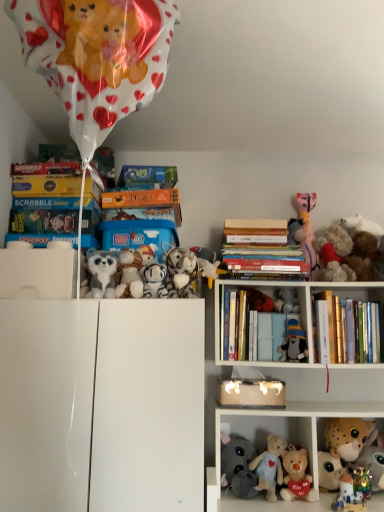
Question: In which direction should I rotate to look at hardcover books at center, which is counted as the third book, starting from the top?

Choices:
 (A) right
 (B) left

Answer: (A)

Question: Is white glossy cabinet at center, placed as the 1th shelf when sorted from left to right, positioned behind fluffy plush toys at right, arranged as the tenth toy when viewed from the left?

Choices:
 (A) no
 (B) yes

Answer: (A)

Question: Considering the relative positions of white glossy cabinet at center, the 2th shelf viewed from the right, and fluffy plush toys at right, the 3th toy positioned from the right, in the image provided, is white glossy cabinet at center, the 2th shelf viewed from the right, to the right of fluffy plush toys at right, the 3th toy positioned from the right, from the viewer's perspective?

Choices:
 (A) yes
 (B) no

Answer: (B)

Question: Are white glossy cabinet at center, the 2th shelf viewed from the right, and fluffy plush toys at right, the 3th toy positioned from the right, beside each other?

Choices:
 (A) yes
 (B) no

Answer: (B)

Question: From the image's perspective, is white glossy cabinet at center, placed as the 1th shelf when sorted from left to right, over fluffy plush toys at right, the 3th toy positioned from the right?

Choices:
 (A) no
 (B) yes

Answer: (A)

Question: Are white glossy cabinet at center, the 2th shelf viewed from the right, and fluffy plush toys at right, arranged as the tenth toy when viewed from the left, far apart?

Choices:
 (A) no
 (B) yes

Answer: (A)

Question: Would you say white glossy cabinet at center, placed as the 1th shelf when sorted from left to right, is outside fluffy plush toys at right, the 3th toy positioned from the right?

Choices:
 (A) yes
 (B) no

Answer: (A)

Question: Is the depth of green cardboard book at upper center, the first book in the top-to-bottom sequence, greater than that of soft plush bear at center, which is the 5th toy in left-to-right order?

Choices:
 (A) yes
 (B) no

Answer: (A)

Question: From the image's perspective, is green cardboard book at upper center, the 2th book viewed from the left, under soft plush bear at center, which is the 5th toy in left-to-right order?

Choices:
 (A) no
 (B) yes

Answer: (A)

Question: From a real-world perspective, is green cardboard book at upper center, the first book in the top-to-bottom sequence, on top of soft plush bear at center, which is the 5th toy in left-to-right order?

Choices:
 (A) yes
 (B) no

Answer: (A)

Question: Would you say green cardboard book at upper center, the 2th book viewed from the left, is outside soft plush bear at center, which is the 8th toy from right to left?

Choices:
 (A) yes
 (B) no

Answer: (A)

Question: Does green cardboard book at upper center, which ranks as the 4th book in bottom-to-top order, turn towards soft plush bear at center, which is the 8th toy from right to left?

Choices:
 (A) yes
 (B) no

Answer: (B)

Question: Can you confirm if green cardboard book at upper center, the third book in the right-to-left sequence, is smaller than soft plush bear at center, which is the 5th toy in left-to-right order?

Choices:
 (A) yes
 (B) no

Answer: (B)

Question: Is white plush toy at upper center, the tenth toy from the right, positioned far away from white plush toys at lower center?

Choices:
 (A) no
 (B) yes

Answer: (A)